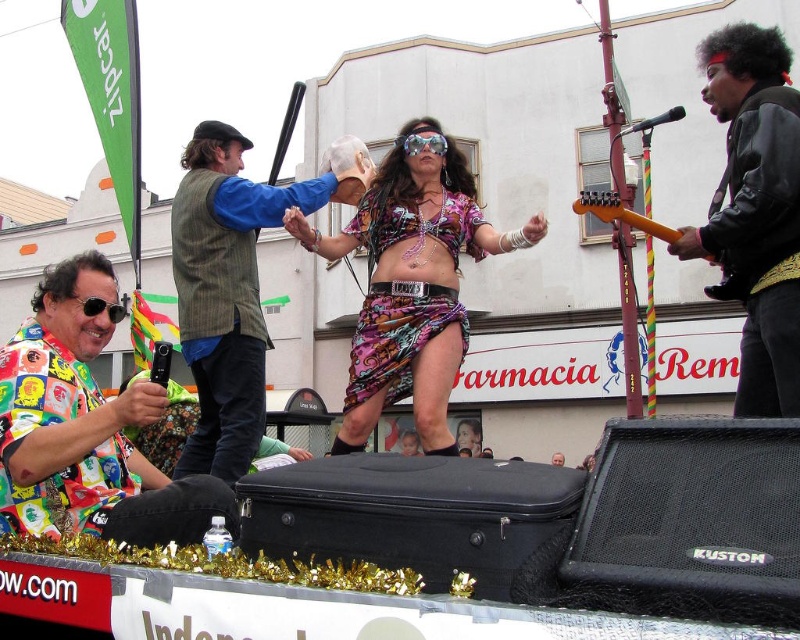
Question: Which is nearer to the printed fabric skirt at center?

Choices:
 (A) striped wool vest at center
 (B) black leather jacket at upper right

Answer: (A)

Question: Is black leather jacket at upper right closer to the viewer compared to striped wool vest at center?

Choices:
 (A) no
 (B) yes

Answer: (B)

Question: Which object is closer to the camera taking this photo?

Choices:
 (A) colorful patchwork shirt at lower left
 (B) striped wool vest at center
 (C) transparent plastic goggles at center

Answer: (A)

Question: Observing the image, what is the correct spatial positioning of colorful patchwork shirt at lower left in reference to striped wool vest at center?

Choices:
 (A) below
 (B) above

Answer: (A)

Question: Does printed fabric skirt at center lie in front of striped wool vest at center?

Choices:
 (A) no
 (B) yes

Answer: (A)

Question: Which point appears closest to the camera in this image?

Choices:
 (A) (682, 228)
 (B) (128, 460)
 (C) (202, 348)

Answer: (B)